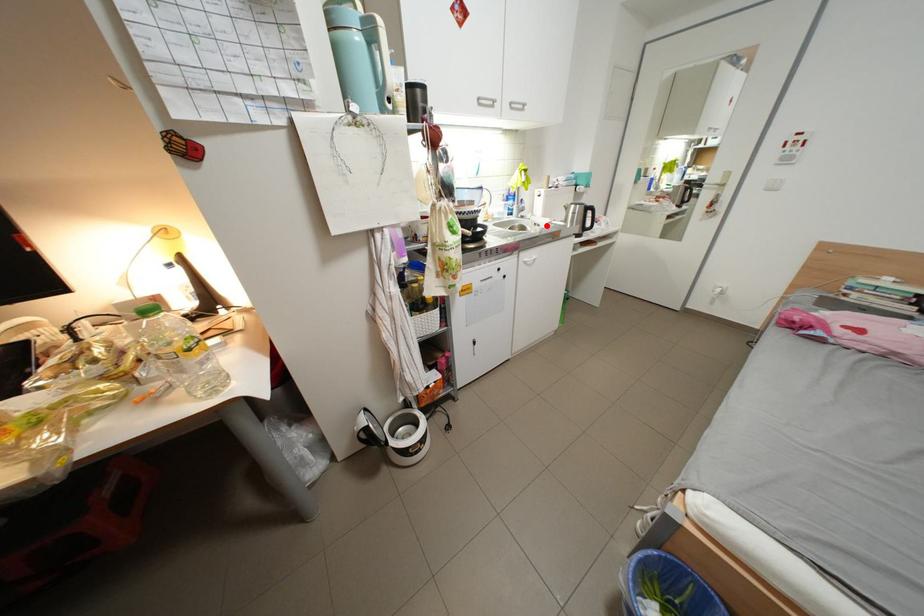
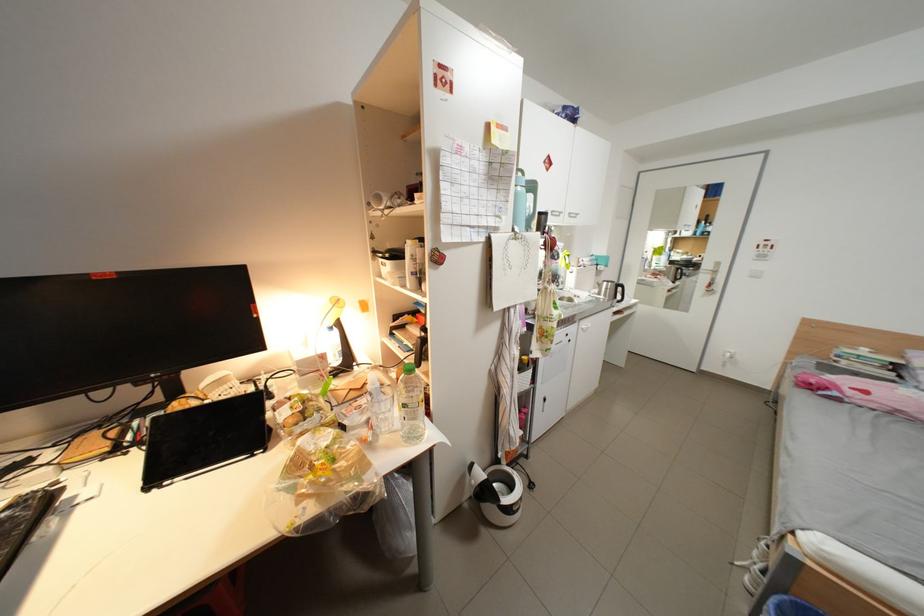
Find the pixel in the second image that matches the highlighted location in the first image.

(587, 297)